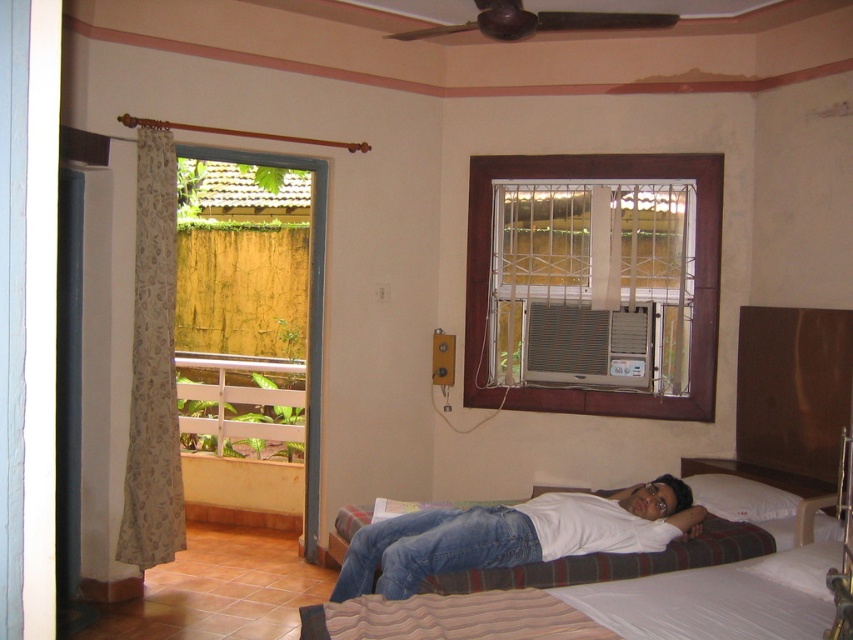
Question: Can you confirm if white fabric hospital bed at center is positioned below white soft pillow at upper right?

Choices:
 (A) no
 (B) yes

Answer: (B)

Question: Which point appears farthest from the camera in this image?

Choices:
 (A) (491, 157)
 (B) (514, 596)

Answer: (A)

Question: Does white matte shirt at center come behind white soft pillow at upper right?

Choices:
 (A) no
 (B) yes

Answer: (A)

Question: Based on their relative distances, which object is nearer to the white matte shirt at center?

Choices:
 (A) beige floral fabric curtain at left
 (B) white soft pillow at upper right

Answer: (B)

Question: Observing the image, what is the correct spatial positioning of white matte shirt at center in reference to beige floral fabric curtain at left?

Choices:
 (A) above
 (B) below

Answer: (B)

Question: Which object is farther from the camera taking this photo?

Choices:
 (A) beige floral fabric curtain at left
 (B) white fabric hospital bed at center
 (C) white matte shirt at center

Answer: (A)